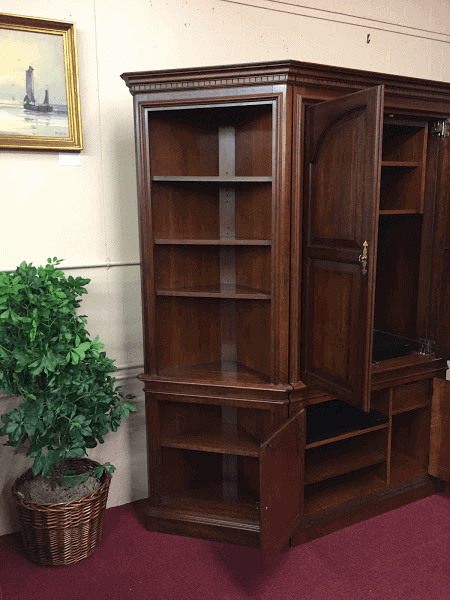
Image resolution: width=450 pixels, height=600 pixels. Identify the location of picture. (40, 72).